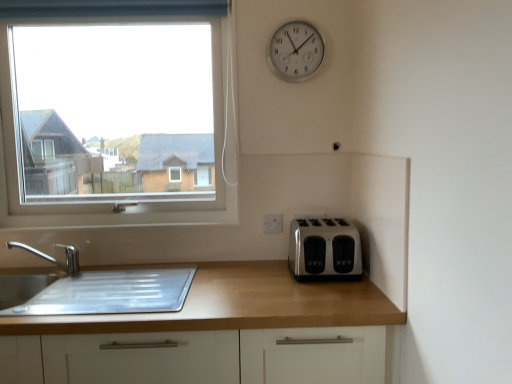
Question: Considering the relative sizes of white plastic electric outlet at center and wooden at right in the image provided, is white plastic electric outlet at center thinner than wooden at right?

Choices:
 (A) yes
 (B) no

Answer: (A)

Question: Does white plastic electric outlet at center have a larger size compared to wooden at right?

Choices:
 (A) no
 (B) yes

Answer: (A)

Question: Is white plastic electric outlet at center closer to camera compared to wooden at right?

Choices:
 (A) no
 (B) yes

Answer: (A)

Question: Is wooden at right a part of white plastic electric outlet at center?

Choices:
 (A) no
 (B) yes

Answer: (A)

Question: From a real-world perspective, is white plastic electric outlet at center on wooden at right?

Choices:
 (A) yes
 (B) no

Answer: (A)

Question: Would you consider white plastic electric outlet at center to be distant from wooden at right?

Choices:
 (A) no
 (B) yes

Answer: (A)

Question: Can you confirm if satin silver toaster at lower right is smaller than white plastic electric outlet at center?

Choices:
 (A) no
 (B) yes

Answer: (A)

Question: Is white plastic electric outlet at center inside satin silver toaster at lower right?

Choices:
 (A) no
 (B) yes

Answer: (A)

Question: From the image's perspective, would you say satin silver toaster at lower right is shown under white plastic electric outlet at center?

Choices:
 (A) yes
 (B) no

Answer: (A)

Question: Is white plastic electric outlet at center at the back of satin silver toaster at lower right?

Choices:
 (A) yes
 (B) no

Answer: (B)

Question: Can you confirm if satin silver toaster at lower right is thinner than white plastic electric outlet at center?

Choices:
 (A) no
 (B) yes

Answer: (A)

Question: Is satin silver toaster at lower right shorter than white plastic electric outlet at center?

Choices:
 (A) yes
 (B) no

Answer: (B)

Question: Is clear glass window at upper left outside satin silver toaster at lower right?

Choices:
 (A) yes
 (B) no

Answer: (A)